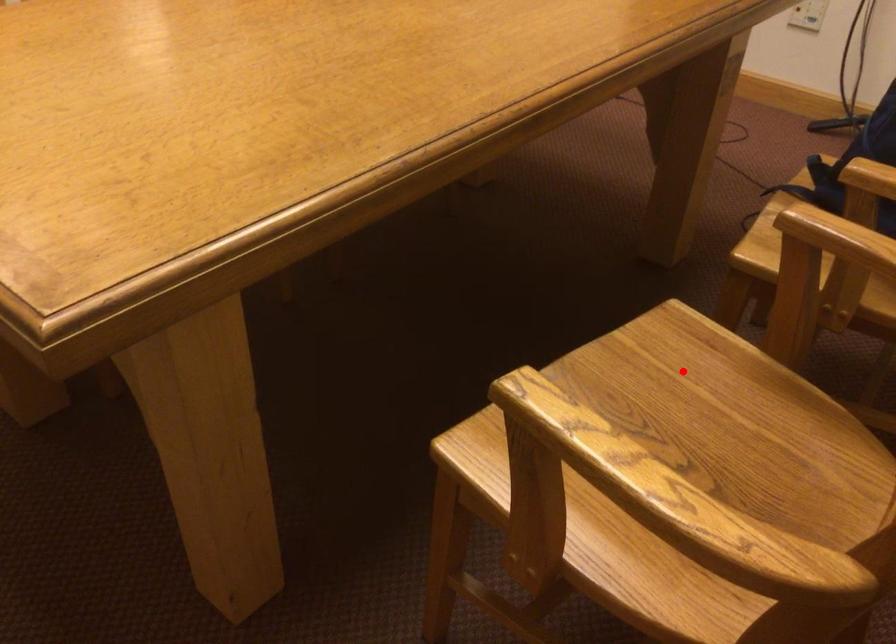
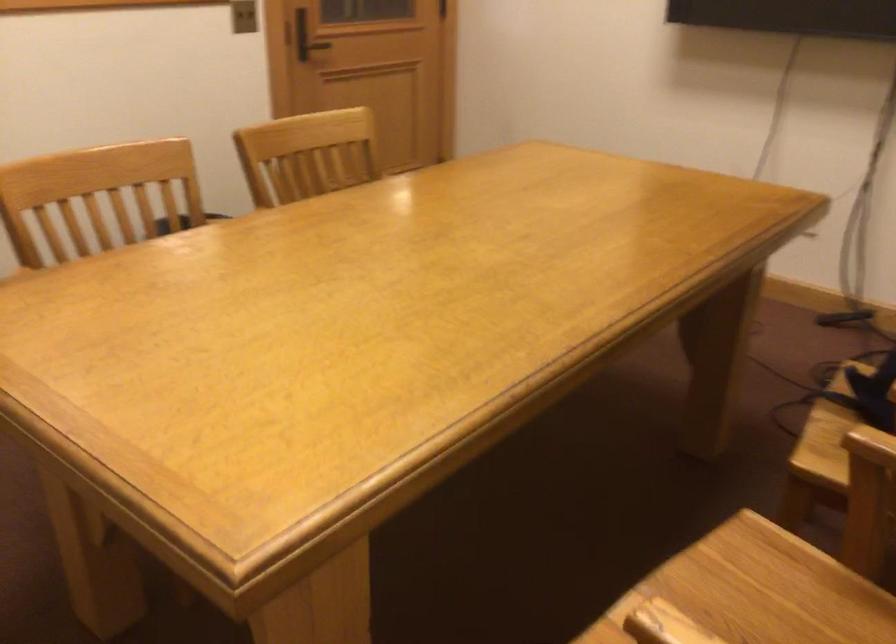
In the second image, find the point that corresponds to the highlighted location in the first image.

(764, 588)